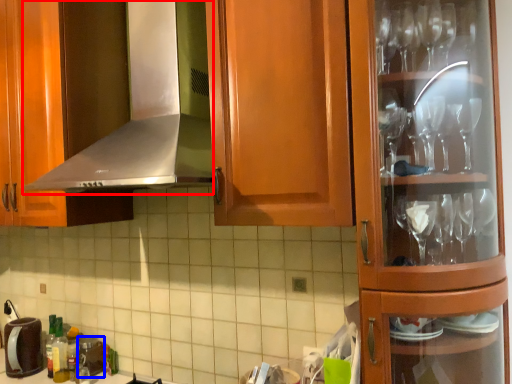
Question: Which of the following is the farthest to the observer, exhaust hood (highlighted by a red box) or appliance (highlighted by a blue box)?

Choices:
 (A) exhaust hood
 (B) appliance

Answer: (B)